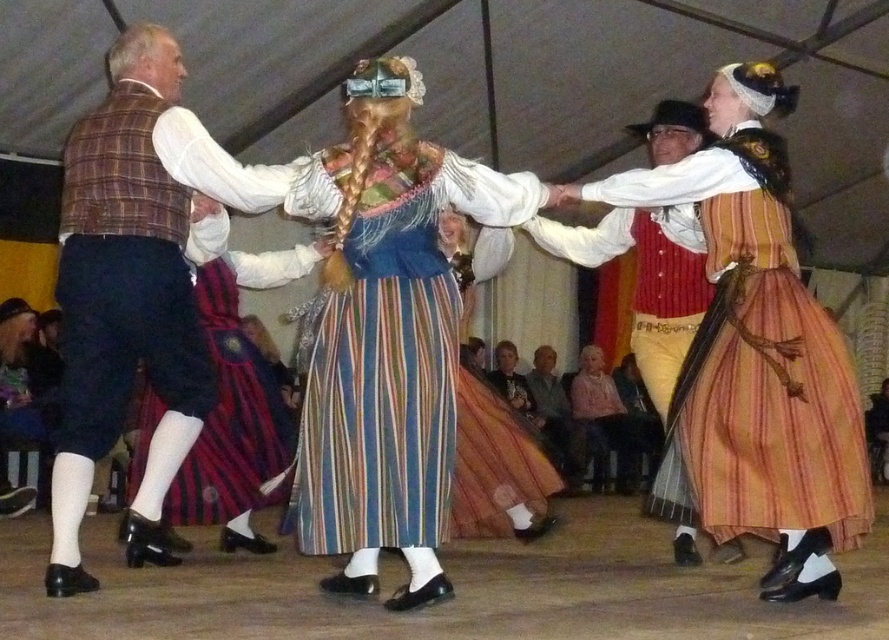
Question: Which object is positioned closest to the striped wool skirt at center?

Choices:
 (A) plaid fabric vest at left
 (B) light pink fabric dress at center
 (C) striped fabric dress at center
 (D) striped cotton dress at center

Answer: (A)

Question: Can you confirm if plaid fabric vest at left is smaller than light pink fabric dress at center?

Choices:
 (A) yes
 (B) no

Answer: (B)

Question: Estimate the real-world distances between objects in this image. Which object is closer to the light pink fabric dress at center?

Choices:
 (A) striped wool skirt at center
 (B) plaid fabric vest at left

Answer: (A)

Question: Can you confirm if striped wool skirt at center is smaller than light brown leather jacket at center?

Choices:
 (A) no
 (B) yes

Answer: (A)

Question: Which object appears farthest from the camera in this image?

Choices:
 (A) striped cotton dress at center
 (B) striped fabric dress at center
 (C) plaid fabric vest at left
 (D) striped wool skirt at center

Answer: (D)

Question: Does striped fabric dress at center lie behind light pink fabric dress at center?

Choices:
 (A) no
 (B) yes

Answer: (A)